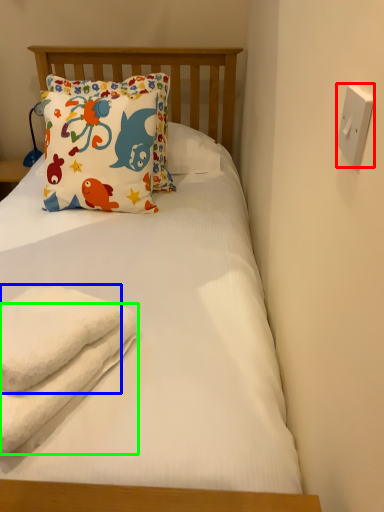
Question: Based on their relative distances, which object is nearer to electric outlet (highlighted by a red box)? Choose from towel (highlighted by a blue box) and beach towel (highlighted by a green box).

Choices:
 (A) towel
 (B) beach towel

Answer: (A)